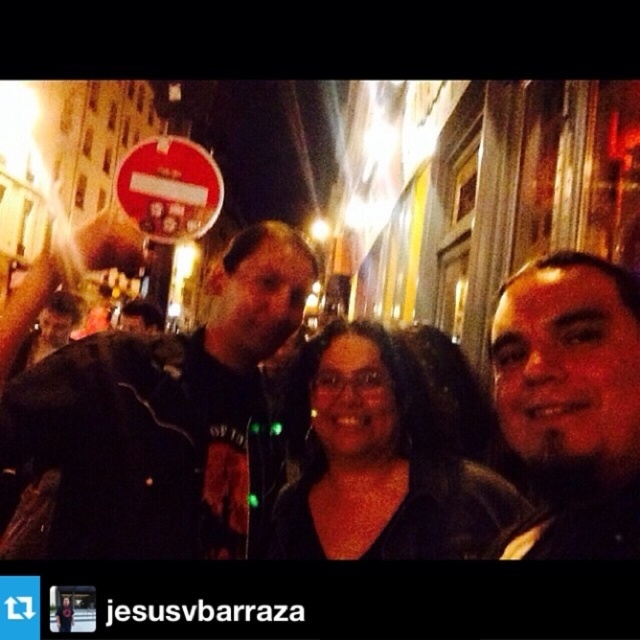
Question: Is dark brown leather jacket at right wider than black matte glasses at center?

Choices:
 (A) no
 (B) yes

Answer: (A)

Question: Can you confirm if black leather jacket at left is thinner than dark brown leather jacket at right?

Choices:
 (A) yes
 (B) no

Answer: (B)

Question: Can you confirm if dark brown leather jacket at right is positioned to the right of black matte glasses at center?

Choices:
 (A) no
 (B) yes

Answer: (B)

Question: Which is farther from the dark brown leather jacket at right?

Choices:
 (A) black matte glasses at center
 (B) black leather jacket at left

Answer: (B)

Question: Among these points, which one is farthest from the camera?

Choices:
 (A) (492, 541)
 (B) (10, 436)

Answer: (B)

Question: Which of the following is the farthest from the observer?

Choices:
 (A) (108, 364)
 (B) (616, 481)
 (C) (497, 492)

Answer: (A)